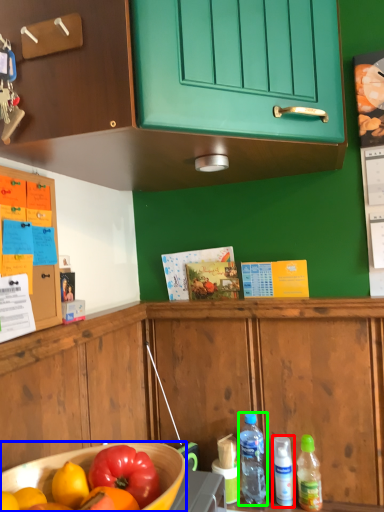
Question: Which is farther away from bottle (highlighted by a red box)? bowl (highlighted by a blue box) or bottle (highlighted by a green box)?

Choices:
 (A) bowl
 (B) bottle

Answer: (A)